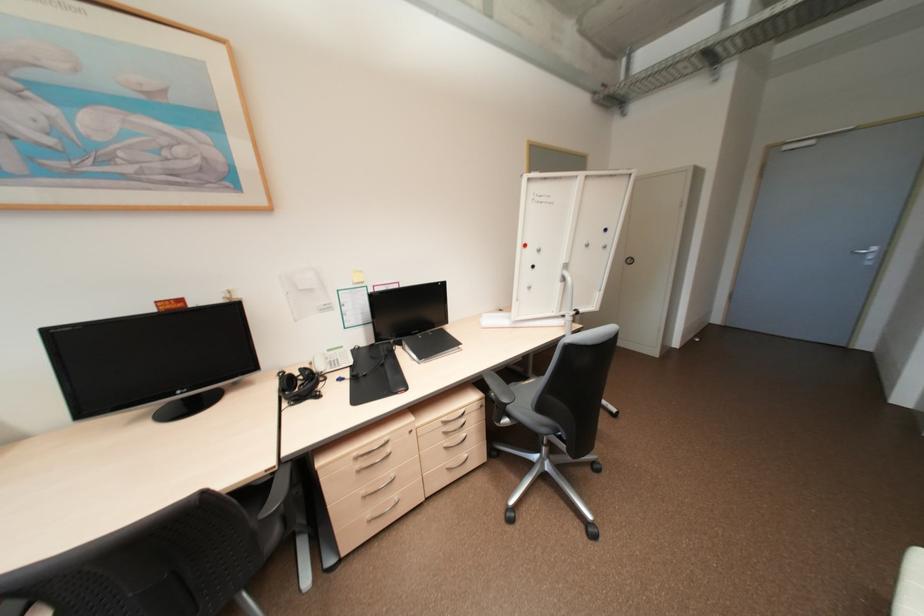
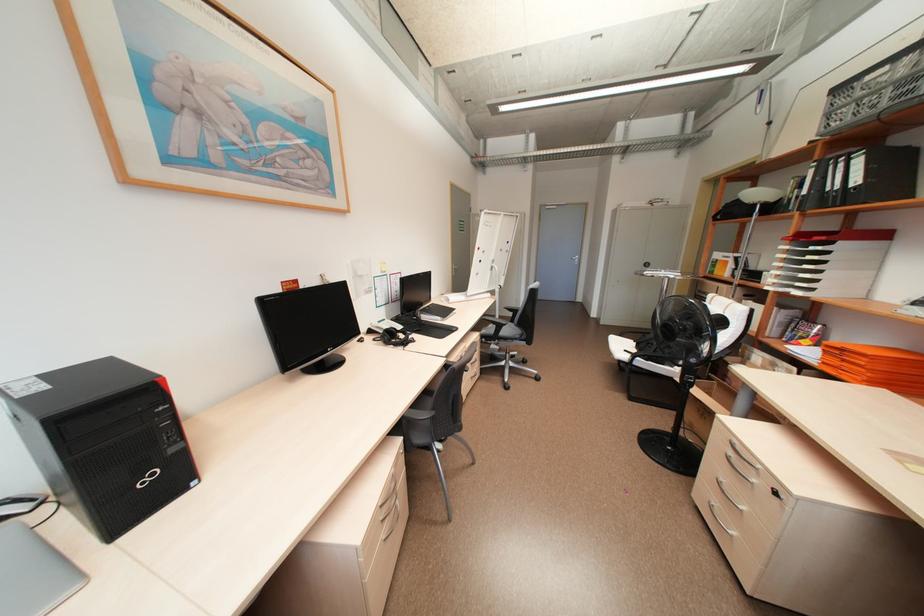
Locate, in the second image, the point that corresponds to (334,350) in the first image.

(384, 322)